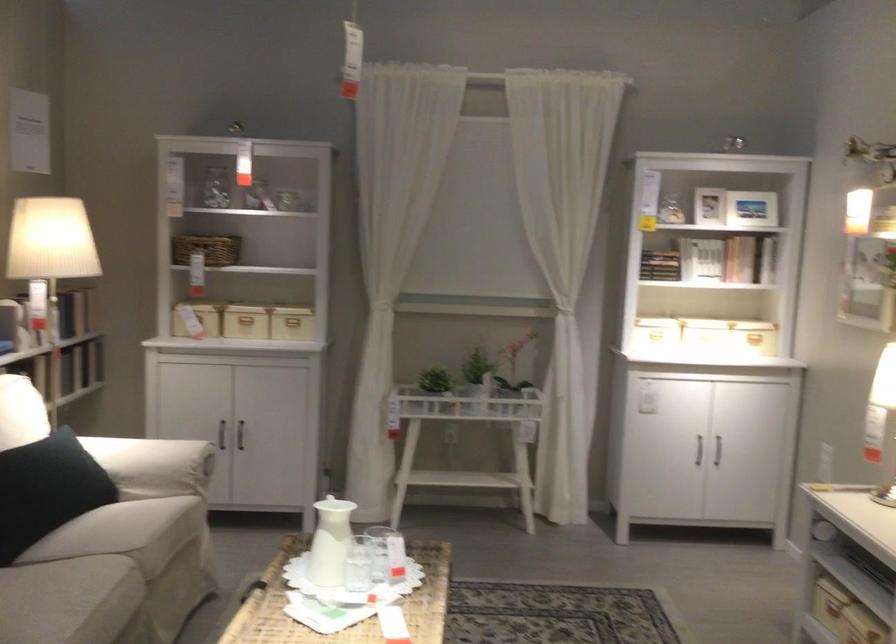
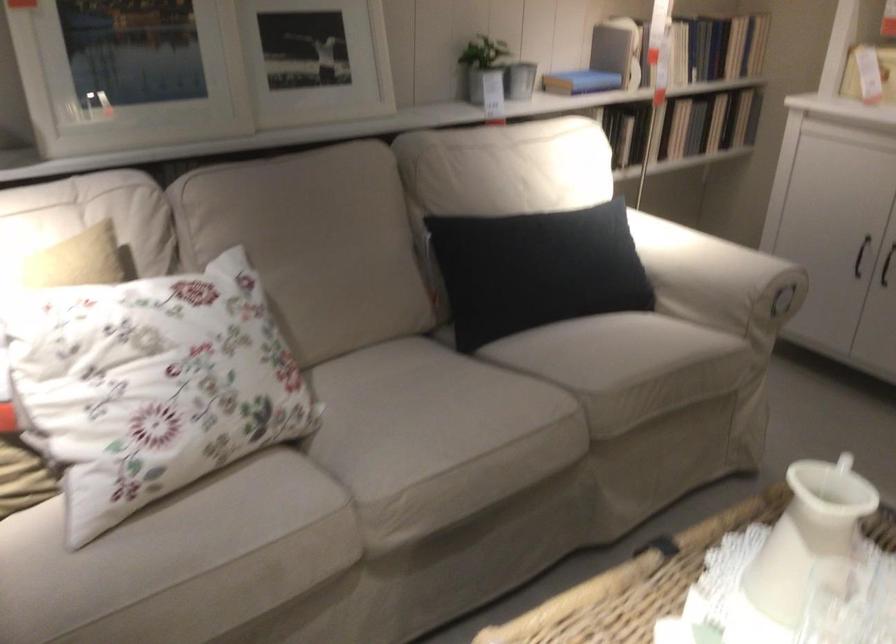
Find the pixel in the second image that matches point 243,442 in the first image.

(886, 265)